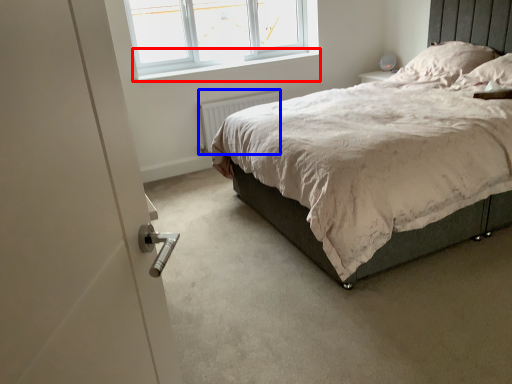
Question: Among these objects, which one is farthest to the camera, window sill (highlighted by a red box) or radiator (highlighted by a blue box)?

Choices:
 (A) window sill
 (B) radiator

Answer: (B)